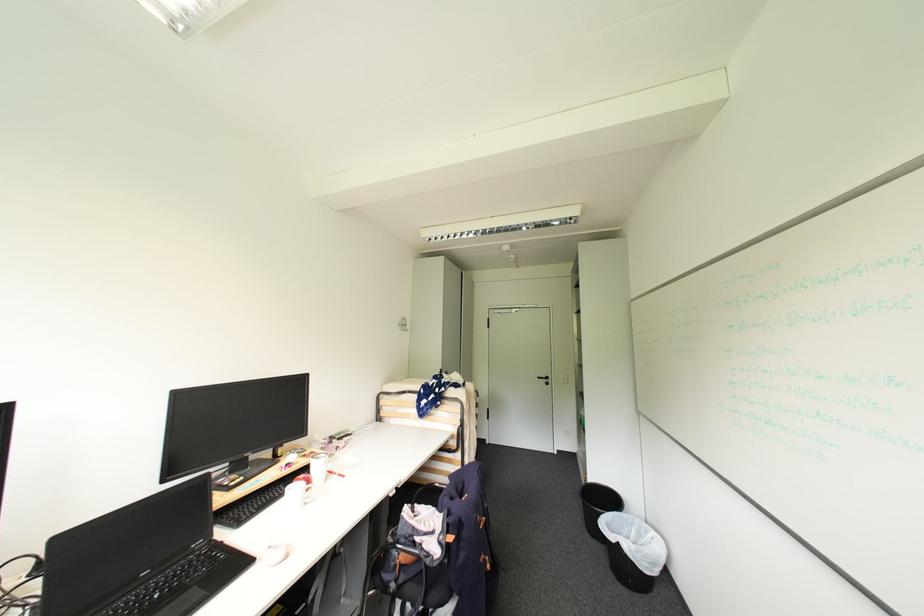
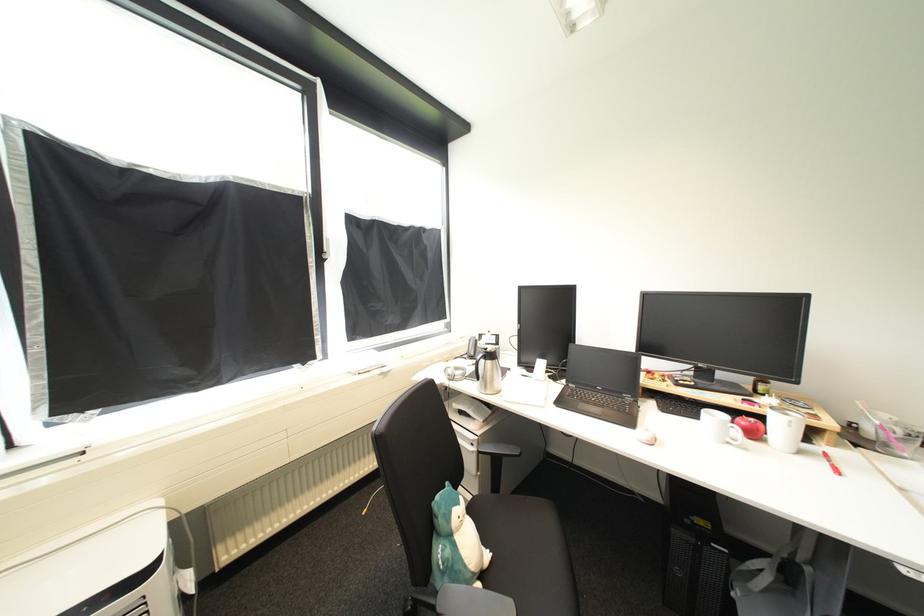
Question: Based on the continuous images, in which direction is the camera rotating? Reply with the corresponding letter.

Choices:
 (A) Left
 (B) Right
 (C) Up
 (D) Down

Answer: (A)